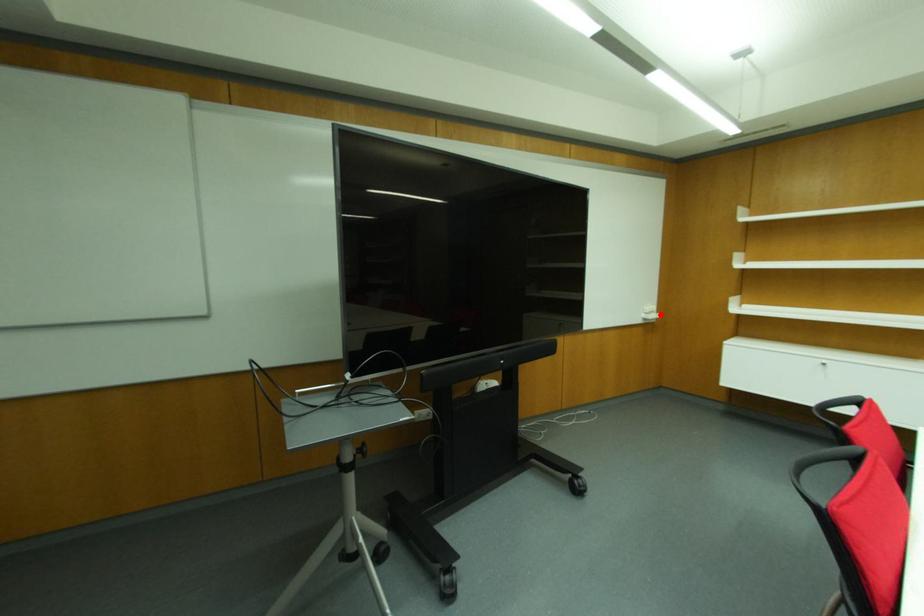
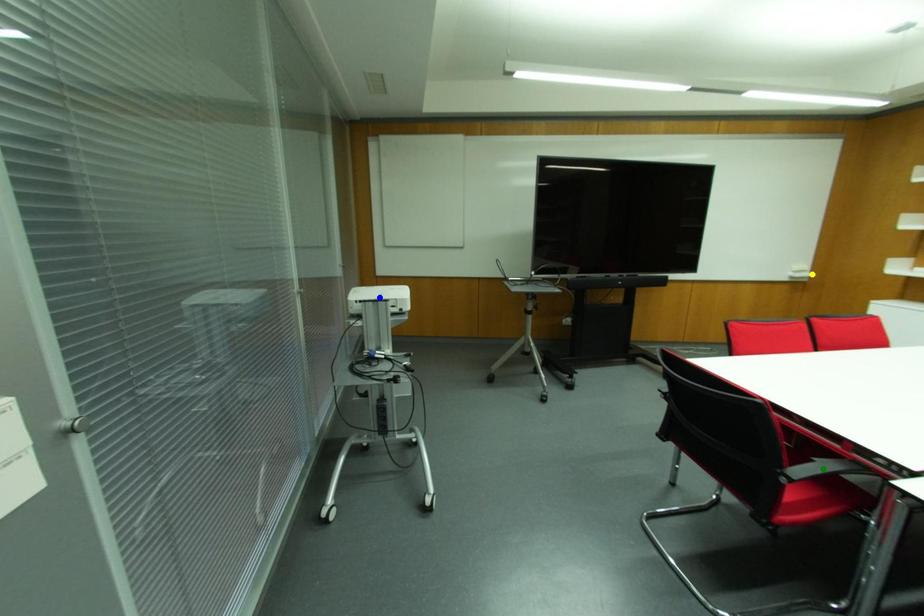
Question: I am providing you with two images of the same scene from different viewpoints. A red point is marked on the first image. You are given multiple points on the second image. In image 2, which mark is for the same physical point as the one in image 1?

Choices:
 (A) green point
 (B) yellow point
 (C) blue point

Answer: (B)